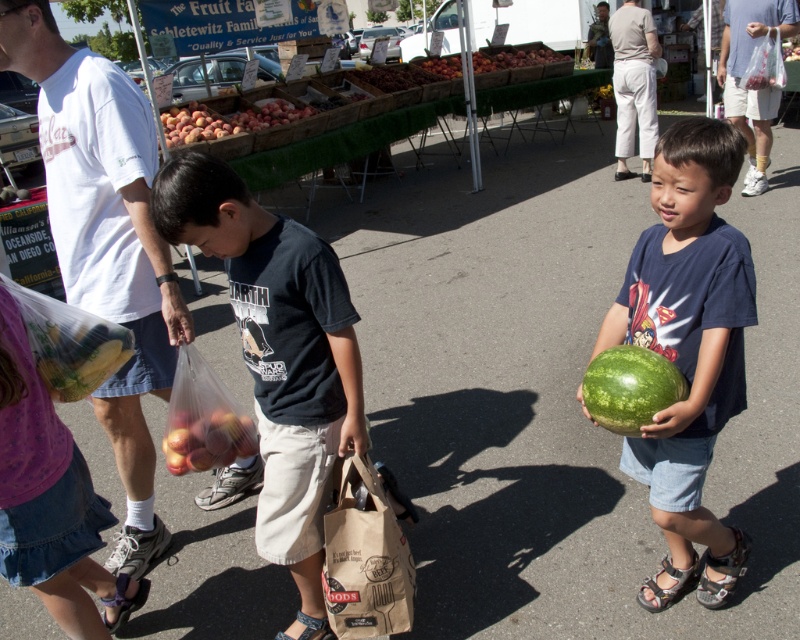
Does brown paper bag at lower center have a lesser width compared to brown fabric sandal at lower left?

No.

Does brown paper bag at lower center lie in front of brown fabric sandal at lower left?

Yes, brown paper bag at lower center is closer to the viewer.

You are a GUI agent. You are given a task and a screenshot of the screen. Output one action in this format:
    pyautogui.click(x=<x>, y=<y>)
    Task: Click on the brown paper bag at lower center
    The width and height of the screenshot is (800, 640).
    Given the screenshot: What is the action you would take?
    pyautogui.click(x=364, y=556)

This screenshot has width=800, height=640. What do you see at coordinates (278, 355) in the screenshot? I see `dark blue t-shirt at center` at bounding box center [278, 355].

Is dark blue t-shirt at center thinner than shiny red apples at lower left?

No.

The image size is (800, 640). Find the location of `dark blue t-shirt at center`. dark blue t-shirt at center is located at coordinates (278, 355).

Is brown paper bag at lower center positioned before multicolored fabric sandal at lower right?

That is True.

Does brown paper bag at lower center appear over multicolored fabric sandal at lower right?

Indeed, brown paper bag at lower center is positioned over multicolored fabric sandal at lower right.

You are a GUI agent. You are given a task and a screenshot of the screen. Output one action in this format:
    pyautogui.click(x=<x>, y=<y>)
    Task: Click on the brown paper bag at lower center
    
    Given the screenshot: What is the action you would take?
    pyautogui.click(x=364, y=556)